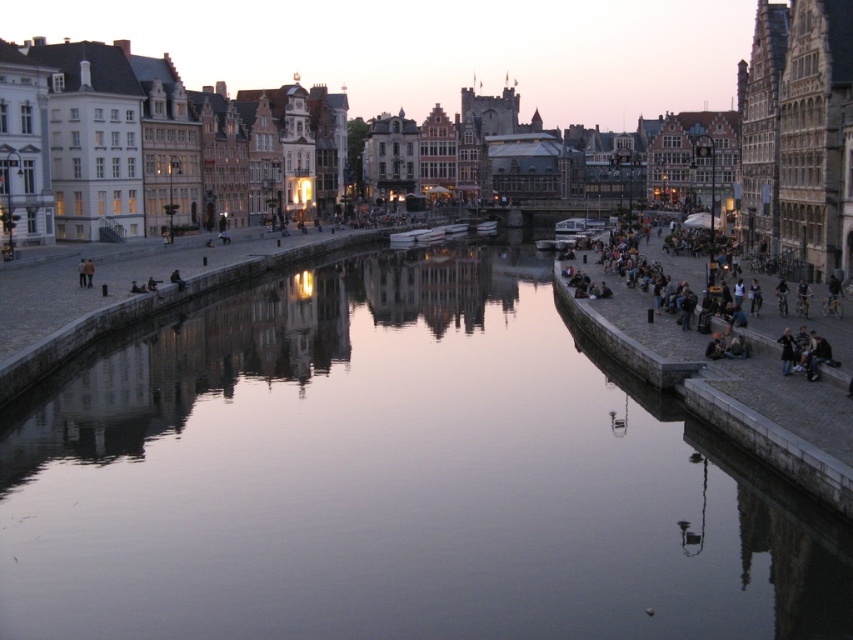
You are standing on the cobblestone street next to the canal. You see the smooth water at center and the dark gray stone people at right. Which object is located below the other?

The smooth water at center is positioned under dark gray stone people at right.

You are a photographer standing at the edge of the canal. You want to capture a photo that includes both the dark gray stone people at right and the dark blue jeans at lower right. Which object should you focus on first if you want to ensure both are in clear view?

The dark gray stone people at right should be focused on first because it is larger than the dark blue jeans at lower right, allowing for better depth of field coverage.